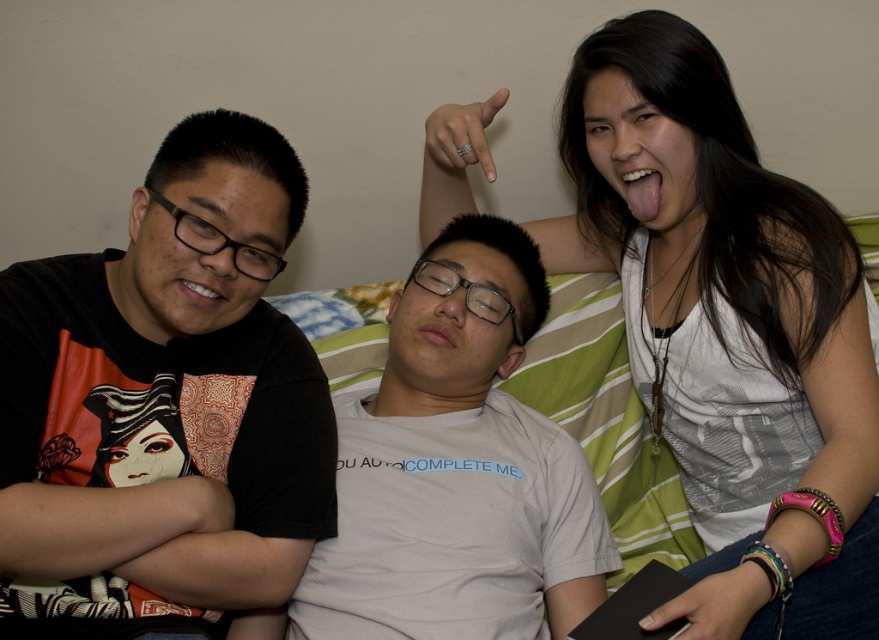
You are taking a photo of two points in the scene. The first point is at coordinates point (282, 502) and the second point is at point (795, 305). Which point is closer to the camera?

Point (282, 502) is closer to the camera than point (795, 305).

Based on the scene description, where is the black matte t shirt at left located? Please provide coordinates in the format of a point like point (164, 406).

The black matte t shirt at left is located at point (164, 406).